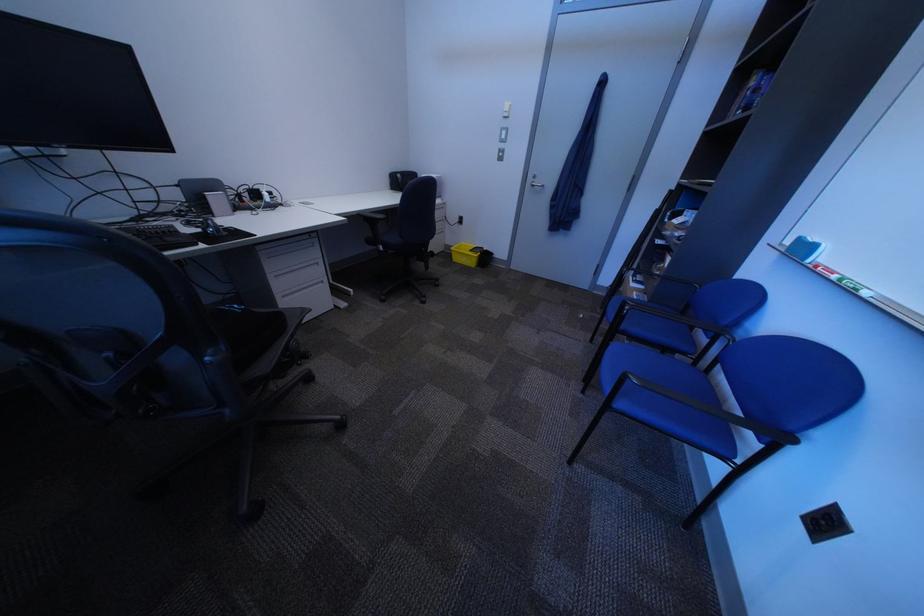
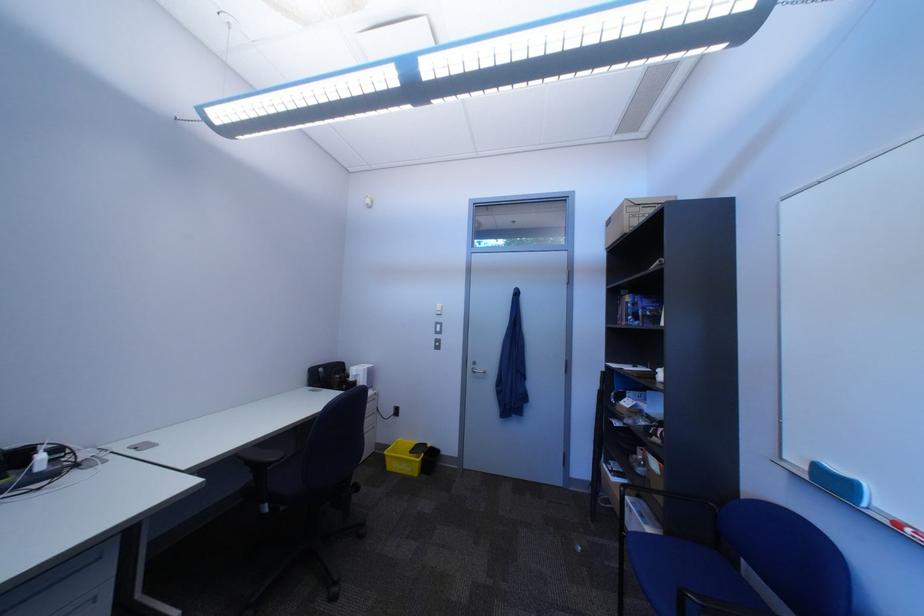
In the second image, find the point that corresponds to point (816, 241) in the first image.

(833, 468)